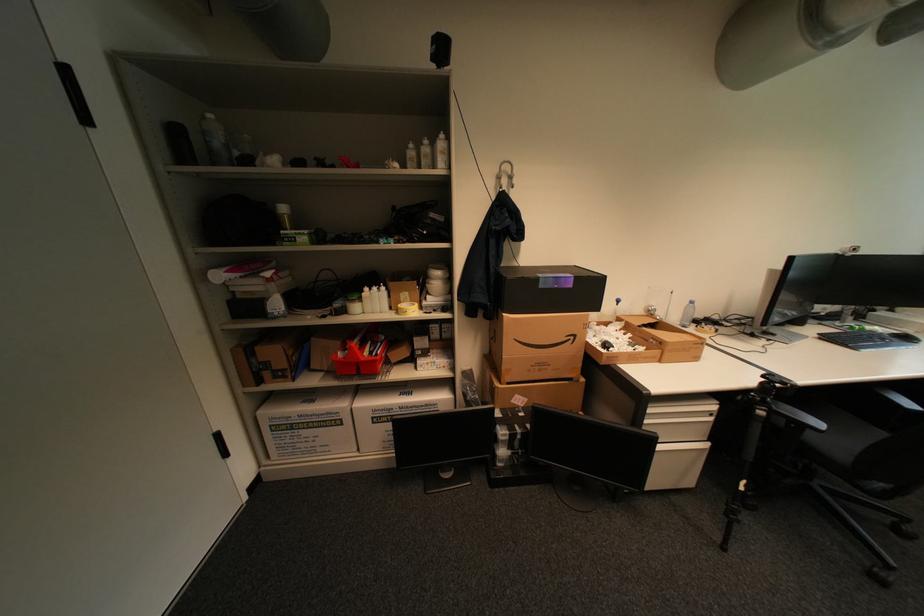
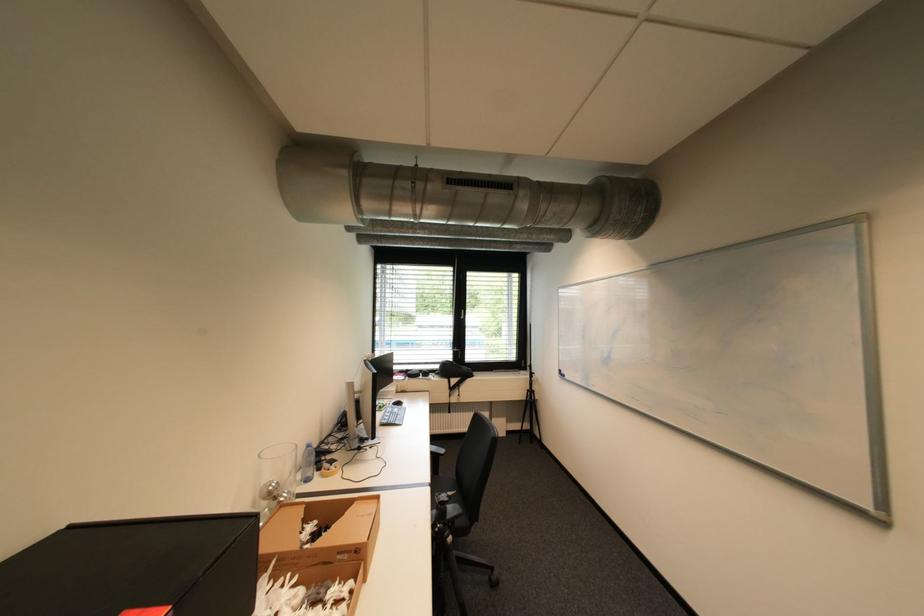
Find the pixel in the second image that matches [614,277] in the first image.

(265, 516)